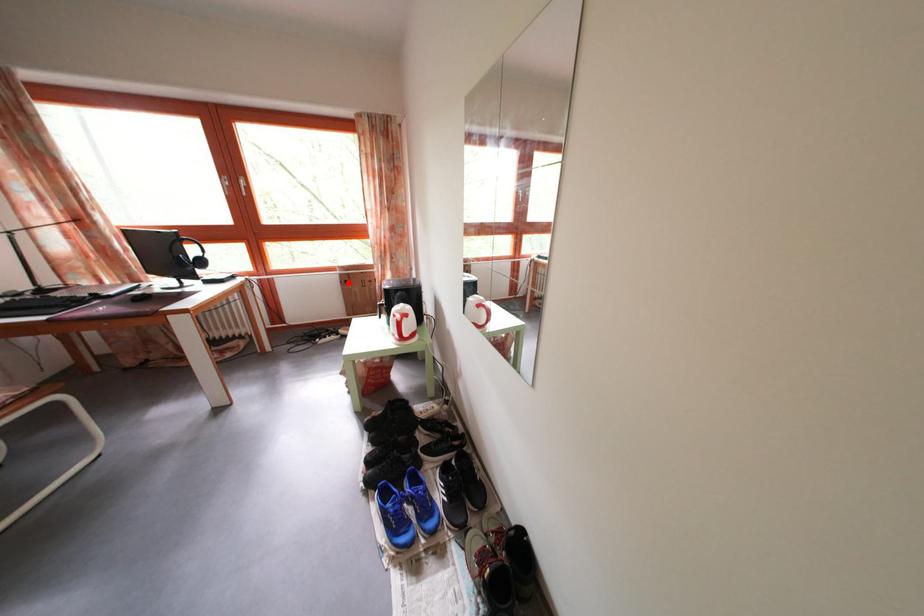
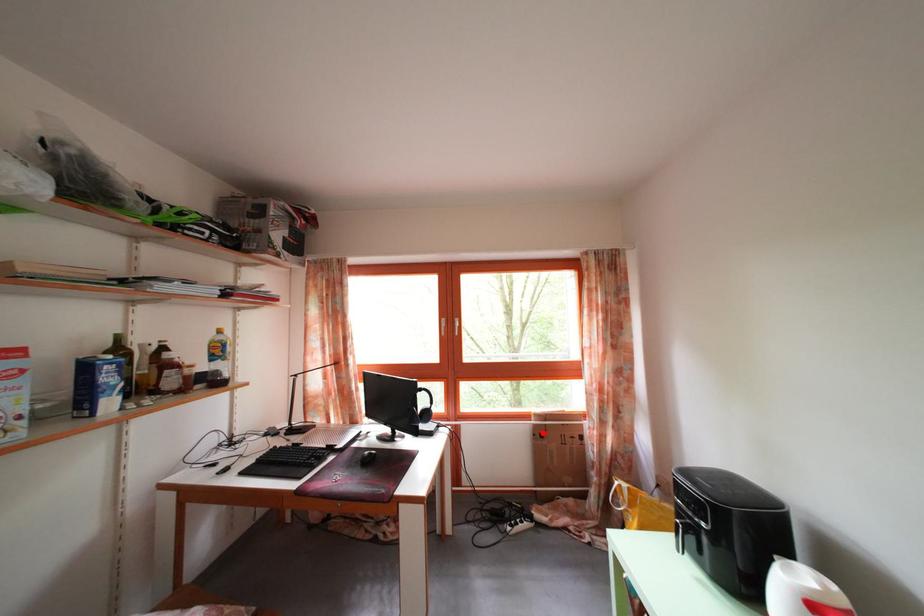
I am providing you with two images of the same scene from different viewpoints. A red point is marked on the first image and another point is marked on the second image. Do the highlighted points in image1 and image2 indicate the same real-world spot?

Yes